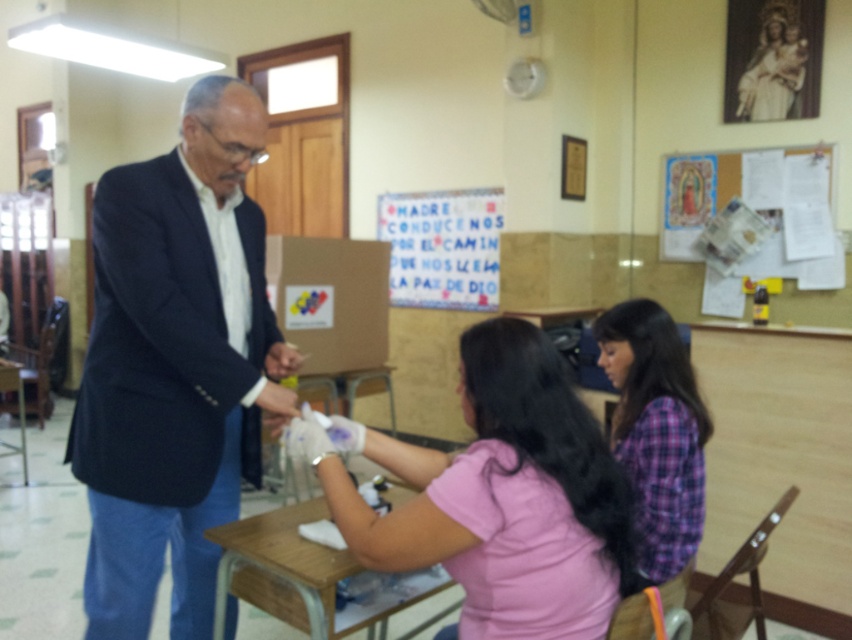
Can you confirm if pink matte shirt at center is wider than wooden desk at lower left?

No.

Where is `pink matte shirt at center`? This screenshot has width=852, height=640. pink matte shirt at center is located at coordinates (505, 499).

Between point (199, 362) and point (272, 596), which one is positioned in front?

Point (199, 362) is more forward.

Between point (165, 541) and point (323, 547), which one is positioned behind?

The point (165, 541) is behind.

This screenshot has width=852, height=640. What are the coordinates of `dark blue suit at center` in the screenshot? It's located at (176, 365).

Is point (347, 515) less distant than point (245, 524)?

Yes, it is.

Can you confirm if pink matte shirt at center is taller than wooden table at center?

Yes, pink matte shirt at center is taller than wooden table at center.

Where is `pink matte shirt at center`? pink matte shirt at center is located at coordinates (505, 499).

Where is `pink matte shirt at center`? The width and height of the screenshot is (852, 640). pink matte shirt at center is located at coordinates (505, 499).